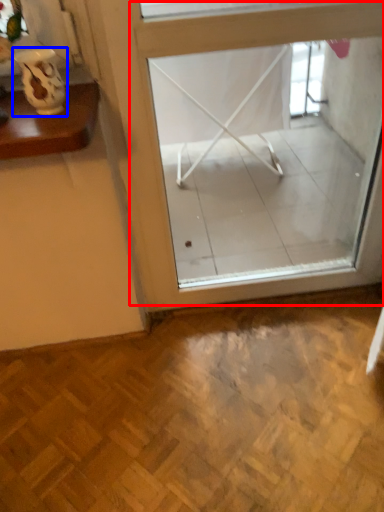
Question: Which object is further to the camera taking this photo, window (highlighted by a red box) or vase (highlighted by a blue box)?

Choices:
 (A) window
 (B) vase

Answer: (A)